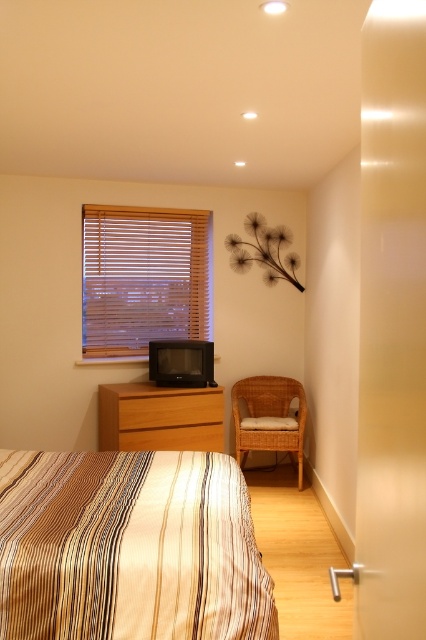
Who is taller, woven wicker chair at right or light brown wood drawer at center?

woven wicker chair at right is taller.

Based on the photo, measure the distance between woven wicker chair at right and camera.

woven wicker chair at right is 4.60 meters away from camera.

The height and width of the screenshot is (640, 426). I want to click on woven wicker chair at right, so click(x=270, y=417).

Is wooden blinds at upper left thinner than light brown wood drawer at center?

In fact, wooden blinds at upper left might be wider than light brown wood drawer at center.

Between wooden blinds at upper left and light brown wood drawer at center, which one appears on the left side from the viewer's perspective?

wooden blinds at upper left

Between point (152, 244) and point (169, 422), which one is positioned behind?

Positioned behind is point (152, 244).

Locate an element on the screen. wooden blinds at upper left is located at coordinates (143, 276).

Is point (149, 444) positioned in front of point (245, 433)?

Yes, point (149, 444) is in front of point (245, 433).

Does light brown wood dresser at lower left have a smaller size compared to woven wicker chair at right?

Correct, light brown wood dresser at lower left occupies less space than woven wicker chair at right.

Which is in front, point (103, 387) or point (281, 413)?

Point (103, 387) is more forward.

The height and width of the screenshot is (640, 426). In order to click on light brown wood dresser at lower left in this screenshot , I will do `click(160, 417)`.